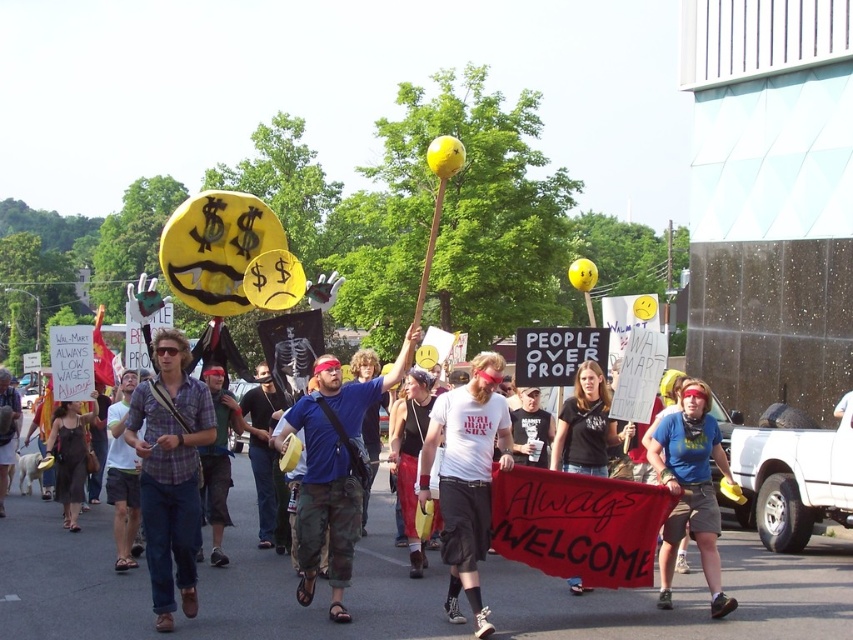
You are a photographer at the protest march and want to capture both the camouflage pants at center and the denim pants at center in the same frame. Which of the two will appear larger in the photo?

The camouflage pants at center will appear larger in the photo because it is much taller than the denim pants at center.

You are a photographer trying to capture a photo of both the camouflage pants at center and the denim pants at center in the same frame. Given that your camera has a minimum focus distance of 3 meters, will you be able to take the photo without moving either subject?

The camouflage pants at center and denim pants at center are 2.97 meters apart, which is less than the camera minimum focus distance of 3 meters. Therefore, you can take the photo without moving either subject.